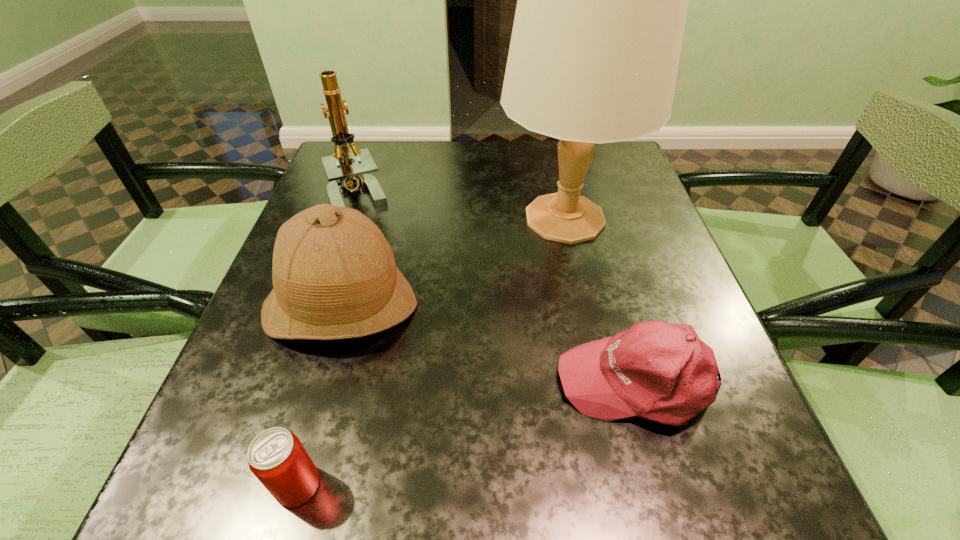
Where is `unoccupied area between the table lamp and the third tallest object`? The image size is (960, 540). unoccupied area between the table lamp and the third tallest object is located at coordinates (453, 262).

Where is `vacant space in between the tallest object and the fourth shortest object`? vacant space in between the tallest object and the fourth shortest object is located at coordinates (462, 206).

At what (x,y) coordinates should I click in order to perform the action: click on vacant area that lies between the third tallest object and the tallest object. Please return your answer as a coordinate pair (x, y). Looking at the image, I should click on (453, 262).

The width and height of the screenshot is (960, 540). Identify the location of free space between the microscope and the tallest object. (462, 206).

This screenshot has height=540, width=960. What are the coordinates of `free spot between the microscope and the baseball cap` in the screenshot? It's located at (498, 287).

Identify the location of the second closest object to the can. (663, 372).

Choose which object is the fourth nearest neighbor to the nearest object. Please provide its 2D coordinates. Your answer should be formatted as a tuple, i.e. [(x, y)], where the tuple contains the x and y coordinates of a point satisfying the conditions above.

[(344, 175)]

Where is `free region that satisfies the following two spatial constraints: 1. on the front-facing side of the nearest object; 2. on the right side of the hat`? Image resolution: width=960 pixels, height=540 pixels. free region that satisfies the following two spatial constraints: 1. on the front-facing side of the nearest object; 2. on the right side of the hat is located at coordinates (289, 485).

What are the coordinates of `vacant point that satisfies the following two spatial constraints: 1. at the eyepiece of the nearest object; 2. on the left side of the microscope` in the screenshot? It's located at (260, 485).

You are a GUI agent. You are given a task and a screenshot of the screen. Output one action in this format:
    pyautogui.click(x=<x>, y=<y>)
    Task: Click on the free space that satisfies the following two spatial constraints: 1. on the back side of the nearest object; 2. on the right side of the table lamp
    Image resolution: width=960 pixels, height=540 pixels.
    Given the screenshot: What is the action you would take?
    pyautogui.click(x=372, y=218)